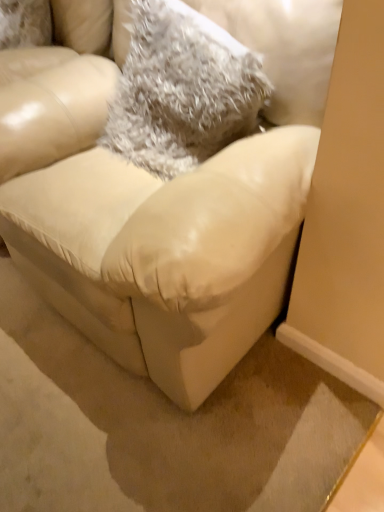
Describe the element at coordinates (146, 226) in the screenshot. I see `matte leather couch at center` at that location.

In order to face matte leather couch at center, should I rotate leftwards or rightwards?

Rotate your view left by about 4.273°.

Find the location of a particular element. The height and width of the screenshot is (512, 384). matte leather couch at center is located at coordinates (146, 226).

The width and height of the screenshot is (384, 512). Describe the element at coordinates (182, 90) in the screenshot. I see `fuzzy gray throw pillow at upper center` at that location.

Where is `fuzzy gray throw pillow at upper center`? The width and height of the screenshot is (384, 512). fuzzy gray throw pillow at upper center is located at coordinates (182, 90).

Image resolution: width=384 pixels, height=512 pixels. What are the coordinates of `matte leather couch at center` in the screenshot? It's located at (146, 226).

Which is more to the right, matte leather couch at center or fuzzy gray throw pillow at upper center?

From the viewer's perspective, fuzzy gray throw pillow at upper center appears more on the right side.

Which object is more forward, matte leather couch at center or fuzzy gray throw pillow at upper center?

matte leather couch at center is more forward.

Is point (41, 241) positioned in front of point (138, 52)?

That is True.

From the image's perspective, is matte leather couch at center located above or below fuzzy gray throw pillow at upper center?

matte leather couch at center is below fuzzy gray throw pillow at upper center.

From a real-world perspective, is matte leather couch at center above or below fuzzy gray throw pillow at upper center?

Clearly, from a real-world perspective, matte leather couch at center is below fuzzy gray throw pillow at upper center.

Considering the sizes of objects matte leather couch at center and fuzzy gray throw pillow at upper center in the image provided, who is wider, matte leather couch at center or fuzzy gray throw pillow at upper center?

matte leather couch at center is wider.

Consider the image. Considering the sizes of objects matte leather couch at center and fuzzy gray throw pillow at upper center in the image provided, who is shorter, matte leather couch at center or fuzzy gray throw pillow at upper center?

Standing shorter between the two is fuzzy gray throw pillow at upper center.

Considering the sizes of objects matte leather couch at center and fuzzy gray throw pillow at upper center in the image provided, who is smaller, matte leather couch at center or fuzzy gray throw pillow at upper center?

With smaller size is fuzzy gray throw pillow at upper center.

Does matte leather couch at center contain fuzzy gray throw pillow at upper center?

Yes, matte leather couch at center is surrounding fuzzy gray throw pillow at upper center.

Is matte leather couch at center far from fuzzy gray throw pillow at upper center?

They are positioned close to each other.

Is matte leather couch at center turned away from fuzzy gray throw pillow at upper center?

Yes, matte leather couch at center's orientation is away from fuzzy gray throw pillow at upper center.

At what (x,y) coordinates should I click in order to perform the action: click on studio couch in front of the fuzzy gray throw pillow at upper center. Please return your answer as a coordinate pair (x, y). The height and width of the screenshot is (512, 384). Looking at the image, I should click on (146, 226).

Is fuzzy gray throw pillow at upper center at the left side of matte leather couch at center?

Incorrect, fuzzy gray throw pillow at upper center is not on the left side of matte leather couch at center.

Does fuzzy gray throw pillow at upper center lie in front of matte leather couch at center?

That is False.

Which is nearer, [164,58] or [77,105]?

Point [164,58]

From the image's perspective, who appears lower, fuzzy gray throw pillow at upper center or matte leather couch at center?

From the image's view, matte leather couch at center is below.

From a real-world perspective, is fuzzy gray throw pillow at upper center physically above matte leather couch at center?

Correct, in the physical world, fuzzy gray throw pillow at upper center is higher than matte leather couch at center.

Considering the sizes of objects fuzzy gray throw pillow at upper center and matte leather couch at center in the image provided, who is wider, fuzzy gray throw pillow at upper center or matte leather couch at center?

Wider between the two is matte leather couch at center.

Who is taller, fuzzy gray throw pillow at upper center or matte leather couch at center?

matte leather couch at center is taller.

Is fuzzy gray throw pillow at upper center smaller than matte leather couch at center?

Yes.

Does fuzzy gray throw pillow at upper center contain matte leather couch at center?

No.

Can you see fuzzy gray throw pillow at upper center touching matte leather couch at center?

fuzzy gray throw pillow at upper center and matte leather couch at center are not in contact.

Is fuzzy gray throw pillow at upper center aimed at matte leather couch at center?

Yes, fuzzy gray throw pillow at upper center is turned towards matte leather couch at center.

Find the location of `studio couch that is in front of the fuzzy gray throw pillow at upper center`. studio couch that is in front of the fuzzy gray throw pillow at upper center is located at coordinates click(x=146, y=226).

Identify the location of throw pillow on the right of the matte leather couch at center. The height and width of the screenshot is (512, 384). (182, 90).

Locate an element on the screen. The width and height of the screenshot is (384, 512). throw pillow above the matte leather couch at center (from the image's perspective) is located at coordinates (182, 90).